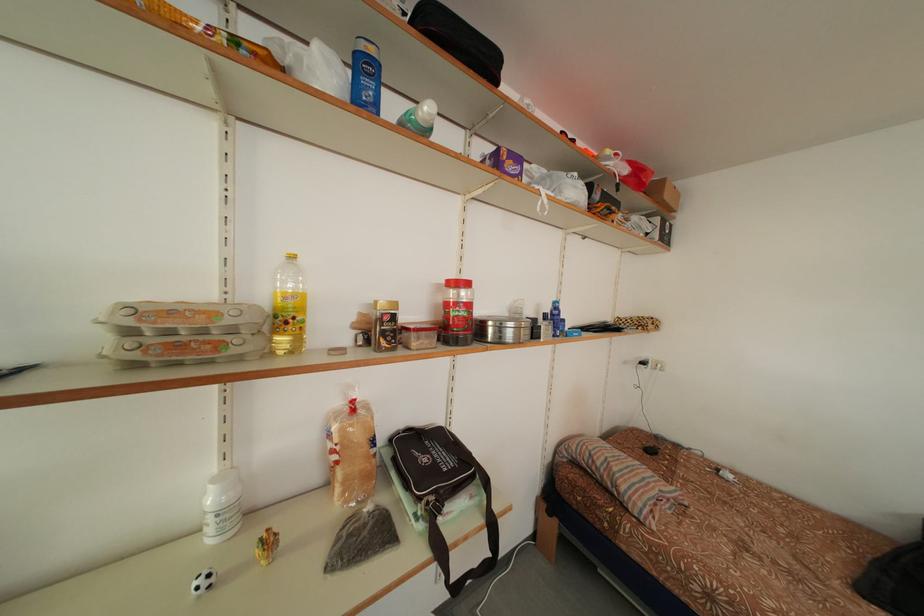
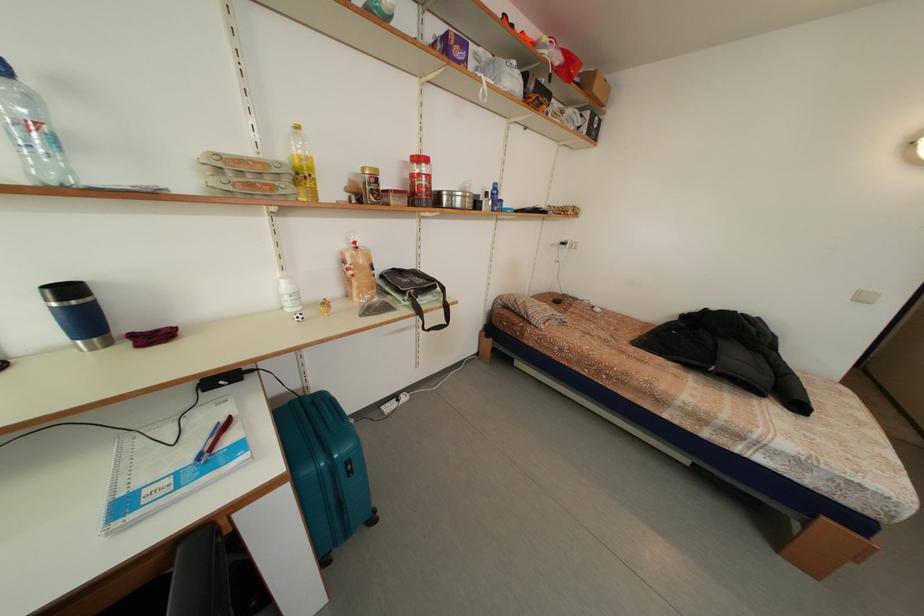
Locate, in the second image, the point that corresponds to (491,527) in the first image.

(448, 310)